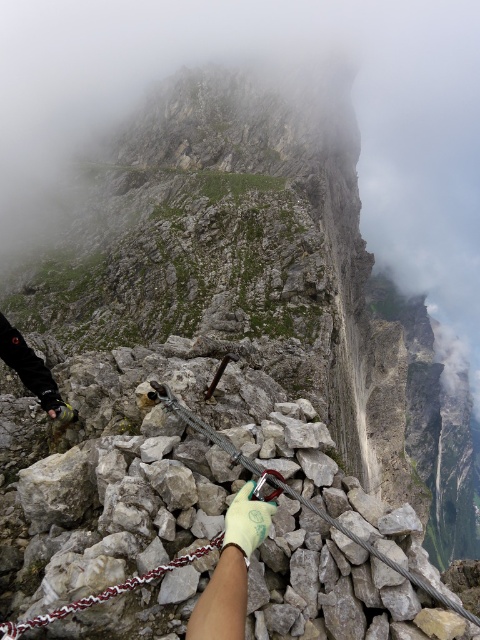
Who is shorter, green rubber glove at center or green fabric glove at center?

With less height is green fabric glove at center.

Which is in front, point (245, 513) or point (261, 541)?

Point (261, 541) is in front.

Is point (237, 632) positioned behind point (271, 520)?

No.

This screenshot has height=640, width=480. In order to click on green rubber glove at center in this screenshot , I will do `click(231, 570)`.

Is green rubber glove at center positioned at the back of white woven rope at center?

That is False.

Locate an element on the screen. The width and height of the screenshot is (480, 640). green rubber glove at center is located at coordinates (231, 570).

Identify the location of green rubber glove at center. This screenshot has height=640, width=480. (231, 570).

Can you confirm if green rubber glove at center is taller than black leather glove at lower left?

No, green rubber glove at center is not taller than black leather glove at lower left.

Is point (271, 512) positioned after point (46, 392)?

No, (271, 512) is closer to viewer.

Where is `green rubber glove at center`? This screenshot has height=640, width=480. green rubber glove at center is located at coordinates (231, 570).